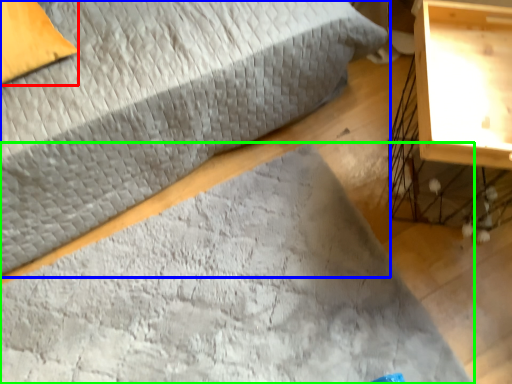
Question: Which object is positioned farthest from pillow (highlighted by a red box)? Select from bed (highlighted by a blue box) and mat (highlighted by a green box).

Choices:
 (A) bed
 (B) mat

Answer: (B)